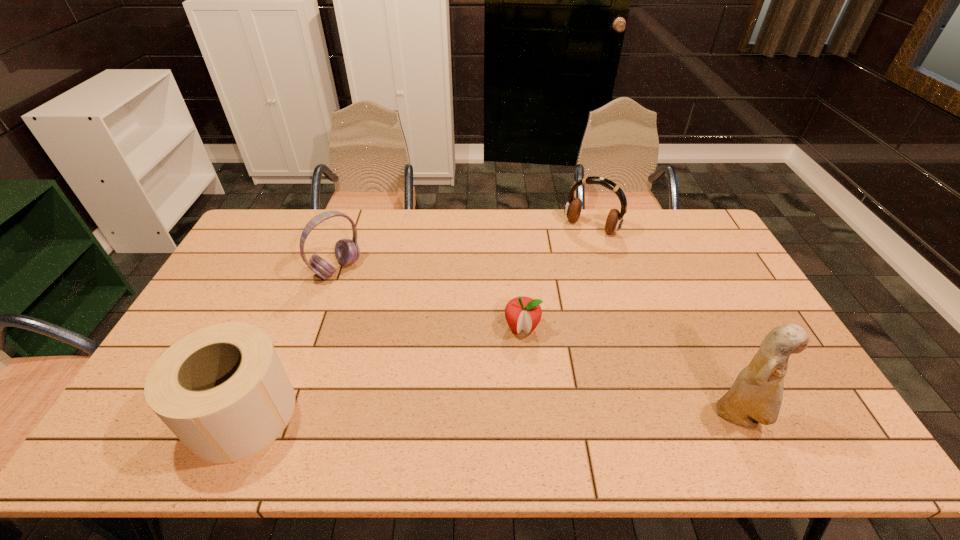
Identify the location of vacant point located between the rightmost object and the shortest object. click(631, 373).

This screenshot has width=960, height=540. I want to click on free spot between the nearer headset and the toilet tissue, so click(x=290, y=341).

Where is `vacant area between the nearer headset and the figurine`? Image resolution: width=960 pixels, height=540 pixels. vacant area between the nearer headset and the figurine is located at coordinates (539, 343).

Find the location of `vacant area between the fourth nearest object and the toilet tissue`. vacant area between the fourth nearest object and the toilet tissue is located at coordinates (290, 341).

Where is `free space between the farthest object and the nearer headset`? This screenshot has width=960, height=540. free space between the farthest object and the nearer headset is located at coordinates (465, 248).

Where is `blank region between the figurine and the toilet tissue`? This screenshot has width=960, height=540. blank region between the figurine and the toilet tissue is located at coordinates (492, 415).

At what (x,y) coordinates should I click in order to perform the action: click on unoccupied position between the left headset and the farthest object. Please return your answer as a coordinate pair (x, y). This screenshot has height=540, width=960. Looking at the image, I should click on (465, 248).

This screenshot has width=960, height=540. I want to click on free space between the second farthest object and the farthest object, so click(x=465, y=248).

Image resolution: width=960 pixels, height=540 pixels. I want to click on free space that is in between the tallest object and the toilet tissue, so click(492, 415).

Image resolution: width=960 pixels, height=540 pixels. In order to click on free space between the tallest object and the third object from right to left in this screenshot , I will do point(631,373).